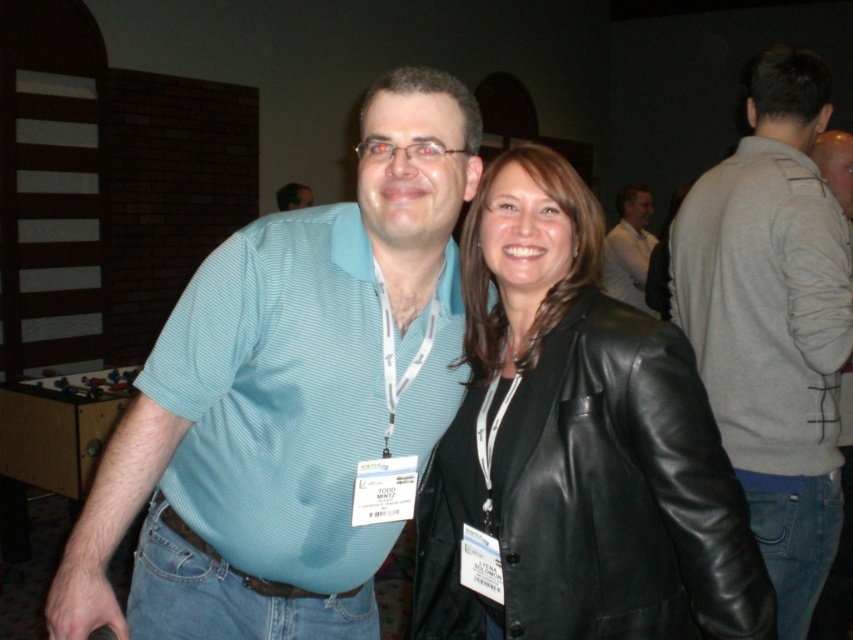
You are organizing a charity event and need to hang a banner between the teal striped shirt at center and the gray sweater at center. The banner requires a minimum height of 1.2 meters to be visible. Can you confirm if the space between them is tall enough?

The teal striped shirt at center is shorter than the gray sweater at center, but the exact heights are not provided. However, since the banner requires a minimum height of 1.2 meters, we cannot confirm if the space between them meets this requirement without additional information about their actual heights.

You are at a conference and need to move from your current position to the registration desk. You notice two points marked in the image. The first point is at coordinate point (361, 572) and the second is at point (786, 250). Which point should you head towards if you want to reach the registration desk quickly?

Point (361, 572) is in front of point (786, 250), so you should head towards point (361, 572) to reach the registration desk quickly.

You are a photographer at a conference. You need to take a group photo of the teal striped shirt at center and smooth skin at center. Which object should you focus on to ensure the larger one is in sharp focus?

The teal striped shirt at center has a larger size compared to smooth skin at center, so you should focus on the teal striped shirt at center to ensure it is in sharp focus.